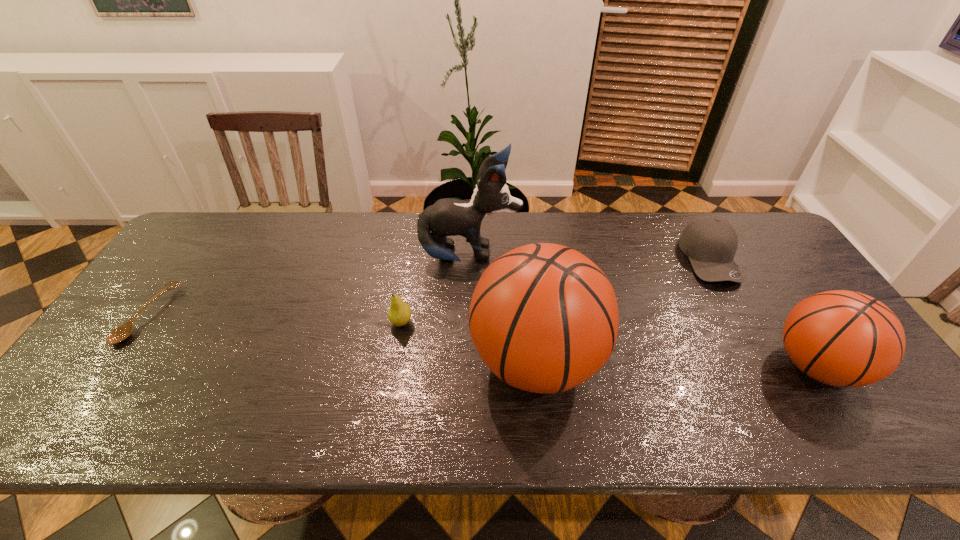
Locate an element on the screen. The width and height of the screenshot is (960, 540). free region located 0.050m on the front brim of the baseball cap is located at coordinates (734, 301).

You are a GUI agent. You are given a task and a screenshot of the screen. Output one action in this format:
    pyautogui.click(x=<x>, y=<y>)
    Task: Click on the vacant space located on the right of the ladle
    
    Given the screenshot: What is the action you would take?
    pyautogui.click(x=299, y=315)

This screenshot has width=960, height=540. Find the location of `free spot located 0.380m on the front-facing side of the puppy`. free spot located 0.380m on the front-facing side of the puppy is located at coordinates (643, 256).

This screenshot has height=540, width=960. I want to click on vacant space located 0.310m on the back of the pear, so click(x=415, y=241).

Find the location of `baseball cap situated at the far edge`. baseball cap situated at the far edge is located at coordinates (710, 242).

Locate an element on the screen. The width and height of the screenshot is (960, 540). puppy located in the far edge section of the desktop is located at coordinates (446, 217).

Locate an element on the screen. object that is at the left edge is located at coordinates tap(122, 332).

Identify the location of basketball that is at the right edge. (842, 338).

The height and width of the screenshot is (540, 960). I want to click on baseball cap that is at the right edge, so click(710, 242).

Identify the location of object that is at the far right corner. (710, 242).